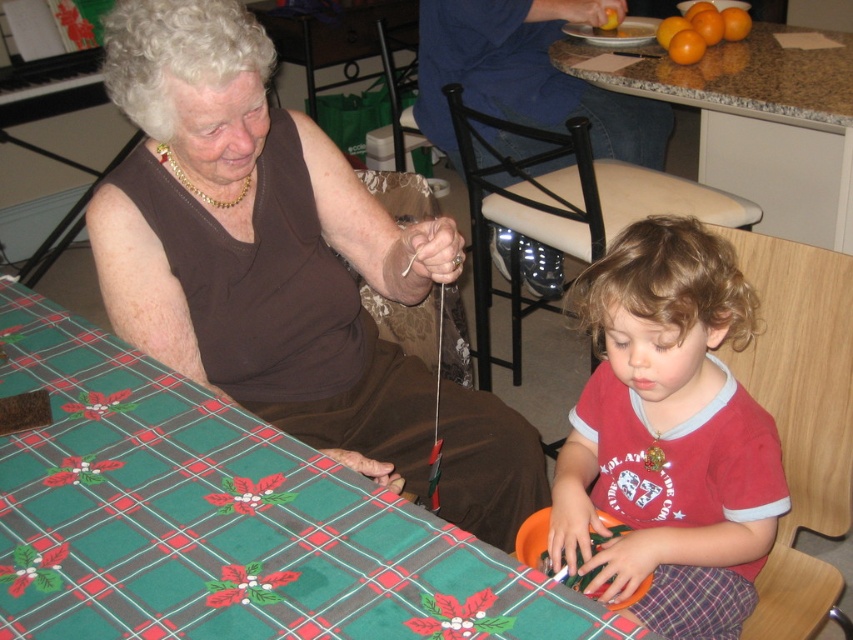
Between brown fabric at upper left and red cotton shirt at lower right, which one appears on the right side from the viewer's perspective?

red cotton shirt at lower right is more to the right.

Between brown fabric at upper left and red cotton shirt at lower right, which one is positioned lower?

Positioned lower is red cotton shirt at lower right.

Measure the distance between point (233,304) and camera.

A distance of 4.37 feet exists between point (233,304) and camera.

Where is `brown fabric at upper left`? The width and height of the screenshot is (853, 640). brown fabric at upper left is located at coordinates (257, 243).

Who is taller, brown fabric at upper left or granite countertop at upper right?

brown fabric at upper left

Who is positioned more to the left, brown fabric at upper left or granite countertop at upper right?

brown fabric at upper left

Is point (218, 164) behind point (784, 160)?

That is False.

I want to click on brown fabric at upper left, so [x=257, y=243].

How far apart are green plaid tablecloth at lower left and red cotton shirt at lower right?

They are 19.13 inches apart.

Can you confirm if green plaid tablecloth at lower left is smaller than red cotton shirt at lower right?

No.

Is point (468, 563) closer to camera compared to point (660, 460)?

Yes, it is in front of point (660, 460).

Identify the location of green plaid tablecloth at lower left. click(222, 518).